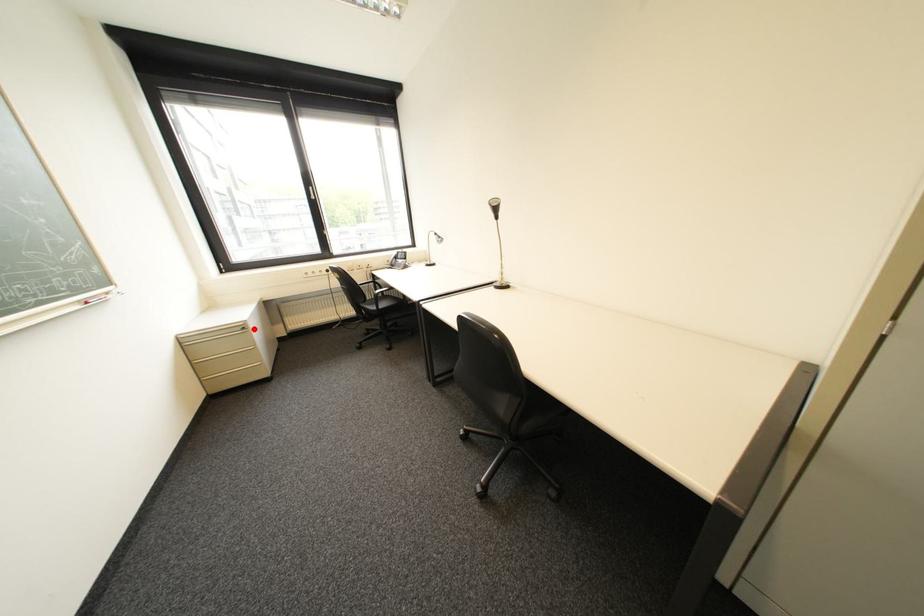
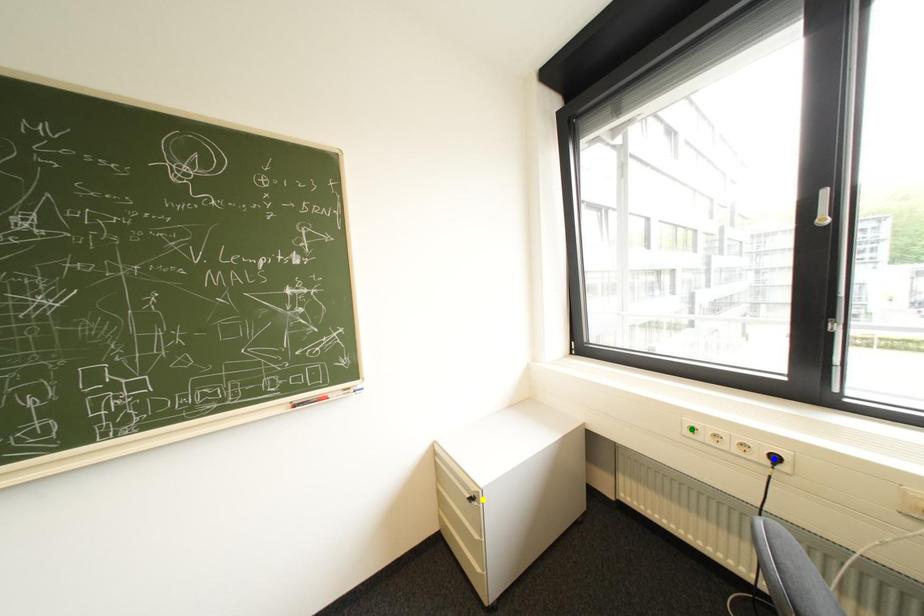
Question: I am providing you with two images of the same scene from different viewpoints. A red point is marked on the first image. You are given multiple points on the second image. Which spot in image 2 lines up with the point in image 1?

Choices:
 (A) yellow point
 (B) green point
 (C) blue point

Answer: (A)